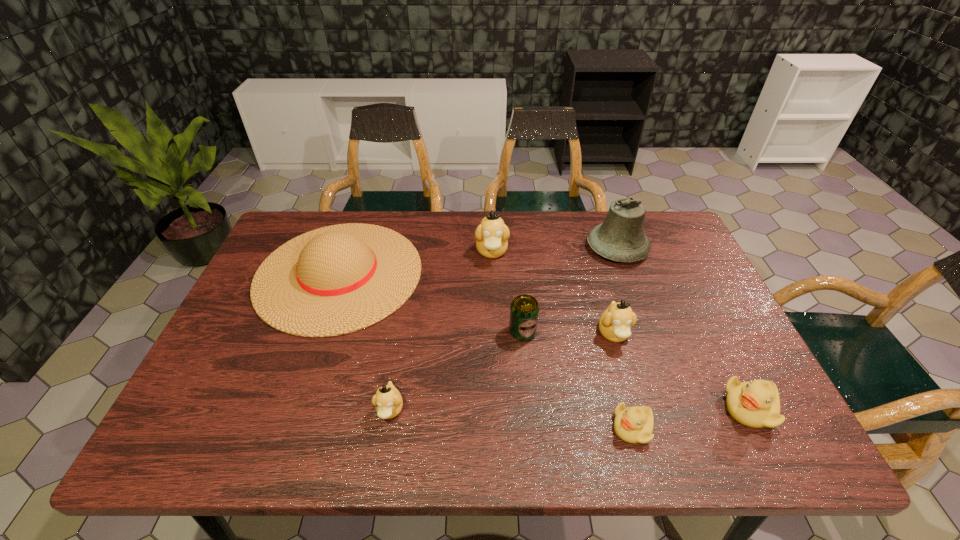
This screenshot has width=960, height=540. Identify the location of the tallest object. (620, 238).

Locate an element on the screen. The width and height of the screenshot is (960, 540). the second tan duckling from left to right is located at coordinates (492, 234).

Locate an element on the screen. the biggest tan duckling is located at coordinates tap(492, 234).

You are a GUI agent. You are given a task and a screenshot of the screen. Output one action in this format:
    pyautogui.click(x=<x>, y=<y>)
    Task: Click on the beige bonnet
    This screenshot has height=540, width=960.
    Given the screenshot: What is the action you would take?
    pyautogui.click(x=338, y=279)

Locate an element on the screen. The height and width of the screenshot is (540, 960). the second nearest tan duckling is located at coordinates (615, 323).

Locate an element on the screen. The height and width of the screenshot is (540, 960). the rightmost tan duckling is located at coordinates (615, 323).

Locate an element on the screen. This screenshot has height=540, width=960. green beer can is located at coordinates click(524, 312).

I want to click on the right yellow duckling, so click(756, 404).

Locate an element on the screen. Image resolution: width=960 pixels, height=540 pixels. the rightmost object is located at coordinates (756, 404).

Find the location of a particular element. This screenshot has width=960, height=540. the leftmost duckling is located at coordinates (388, 402).